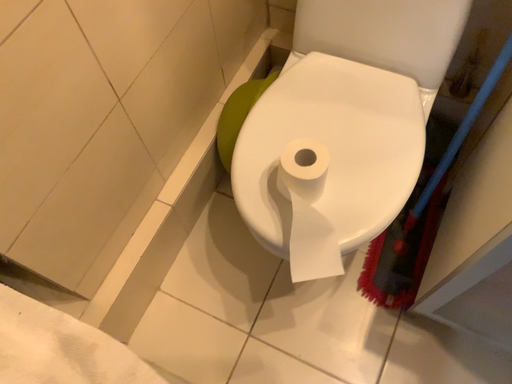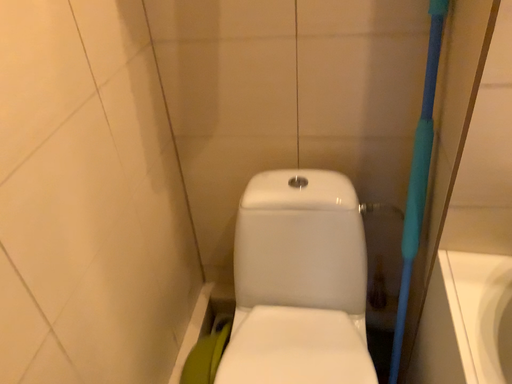
Question: Which way did the camera rotate in the video?

Choices:
 (A) rotated upward
 (B) rotated downward

Answer: (A)